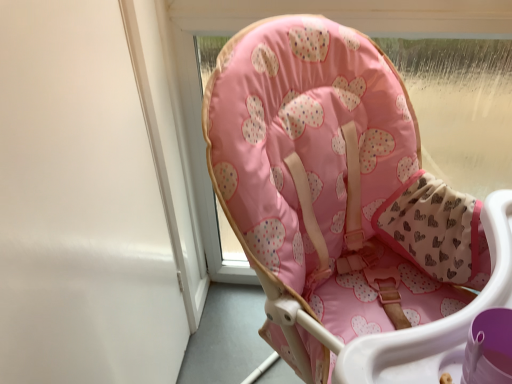
Question: In the image, is white matte screen door at upper left positioned in front of or behind pink fabric baby chair at center?

Choices:
 (A) front
 (B) behind

Answer: (B)

Question: In terms of width, does white matte screen door at upper left look wider or thinner when compared to pink fabric baby chair at center?

Choices:
 (A) wide
 (B) thin

Answer: (B)

Question: Is point (96, 1) closer or farther from the camera than point (397, 91)?

Choices:
 (A) closer
 (B) farther

Answer: (A)

Question: Considering the positions of pink fabric baby chair at center and white matte screen door at upper left in the image, is pink fabric baby chair at center taller or shorter than white matte screen door at upper left?

Choices:
 (A) tall
 (B) short

Answer: (A)

Question: Considering the positions of point (331, 91) and point (136, 107), is point (331, 91) closer or farther from the camera than point (136, 107)?

Choices:
 (A) farther
 (B) closer

Answer: (B)

Question: From a real-world perspective, relative to white matte screen door at upper left, is pink fabric baby chair at center vertically above or below?

Choices:
 (A) above
 (B) below

Answer: (B)

Question: Choose the correct answer: Is pink fabric baby chair at center inside white matte screen door at upper left or outside it?

Choices:
 (A) outside
 (B) inside

Answer: (A)